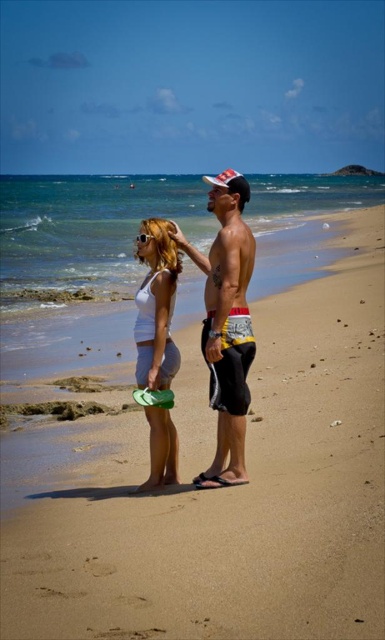
Question: Which object appears farthest from the camera in this image?

Choices:
 (A) shiny metallic shorts at center
 (B) white matte tank top at center
 (C) sandy beach at center

Answer: (B)

Question: Which of these objects is positioned closest to the shiny metallic shorts at center?

Choices:
 (A) white matte tank top at center
 (B) sandy beach at center

Answer: (A)

Question: Is sandy beach at center smaller than shiny metallic shorts at center?

Choices:
 (A) no
 (B) yes

Answer: (A)

Question: Is sandy beach at center further to the viewer compared to shiny metallic shorts at center?

Choices:
 (A) no
 (B) yes

Answer: (A)

Question: Is sandy beach at center further to camera compared to shiny metallic shorts at center?

Choices:
 (A) no
 (B) yes

Answer: (A)

Question: Which point is farther to the camera?

Choices:
 (A) shiny metallic shorts at center
 (B) white matte tank top at center
 (C) sandy beach at center

Answer: (B)